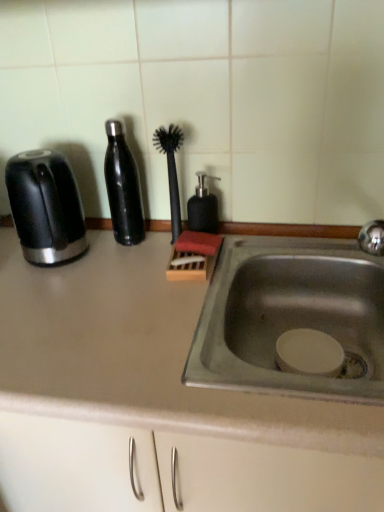
Locate an element on the screen. vacant area situated to the left side of black glossy toaster at left is located at coordinates (10, 253).